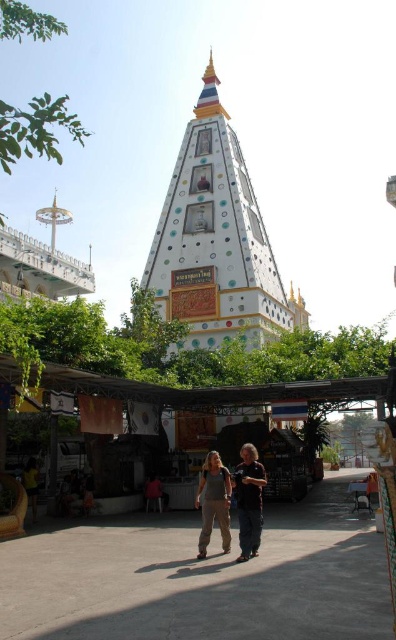
You are standing at the point with coordinates point (249, 500) and want to walk towards the white pagoda structure. Which direction should you go?

The point (249, 500) is the location of the dark brown leather jacket at center. To walk towards the white pagoda structure, you should go north.

You are a photographer standing in front of the white pagoda with a camera. You notice a dark brown leather jacket at center and denim pants at center. Which item takes up more space in your photo?

The denim pants at center takes up more space than the dark brown leather jacket at center because the dark brown leather jacket at center occupies less space than denim pants at center.